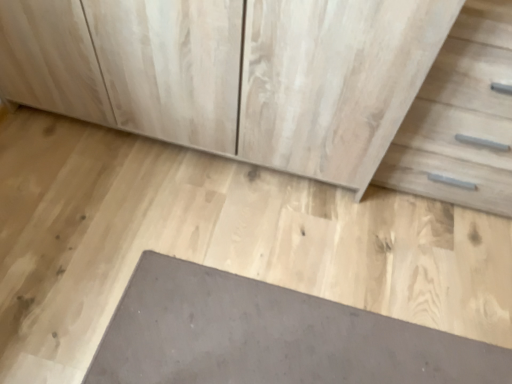
Question: Considering the relative positions of gray concrete at center and slate at lower center in the image provided, is gray concrete at center to the left of slate at lower center from the viewer's perspective?

Choices:
 (A) yes
 (B) no

Answer: (A)

Question: Can you confirm if gray concrete at center is positioned to the right of slate at lower center?

Choices:
 (A) no
 (B) yes

Answer: (A)

Question: Considering the relative sizes of gray concrete at center and slate at lower center in the image provided, is gray concrete at center thinner than slate at lower center?

Choices:
 (A) no
 (B) yes

Answer: (A)

Question: From the image's perspective, is gray concrete at center under slate at lower center?

Choices:
 (A) no
 (B) yes

Answer: (A)

Question: Considering the relative sizes of gray concrete at center and slate at lower center in the image provided, is gray concrete at center smaller than slate at lower center?

Choices:
 (A) yes
 (B) no

Answer: (B)

Question: In terms of size, does gray concrete at center appear bigger or smaller than slate at lower center?

Choices:
 (A) big
 (B) small

Answer: (A)

Question: Is gray concrete at center to the left or to the right of slate at lower center in the image?

Choices:
 (A) left
 (B) right

Answer: (A)

Question: In the image, is gray concrete at center positioned in front of or behind slate at lower center?

Choices:
 (A) front
 (B) behind

Answer: (A)

Question: From a real-world perspective, is gray concrete at center above or below slate at lower center?

Choices:
 (A) below
 (B) above

Answer: (A)

Question: Which is correct: light wood drawer at right is inside slate at lower center, or outside of it?

Choices:
 (A) outside
 (B) inside

Answer: (A)

Question: Is light wood drawer at right wider or thinner than slate at lower center?

Choices:
 (A) thin
 (B) wide

Answer: (A)

Question: From a real-world perspective, is light wood drawer at right physically located above or below slate at lower center?

Choices:
 (A) above
 (B) below

Answer: (A)

Question: Is light wood drawer at right in front of or behind slate at lower center in the image?

Choices:
 (A) behind
 (B) front

Answer: (B)

Question: From the image's perspective, relative to gray concrete at center, is light wood cabinet at center above or below?

Choices:
 (A) above
 (B) below

Answer: (A)

Question: Visually, is light wood cabinet at center positioned to the left or to the right of gray concrete at center?

Choices:
 (A) right
 (B) left

Answer: (B)